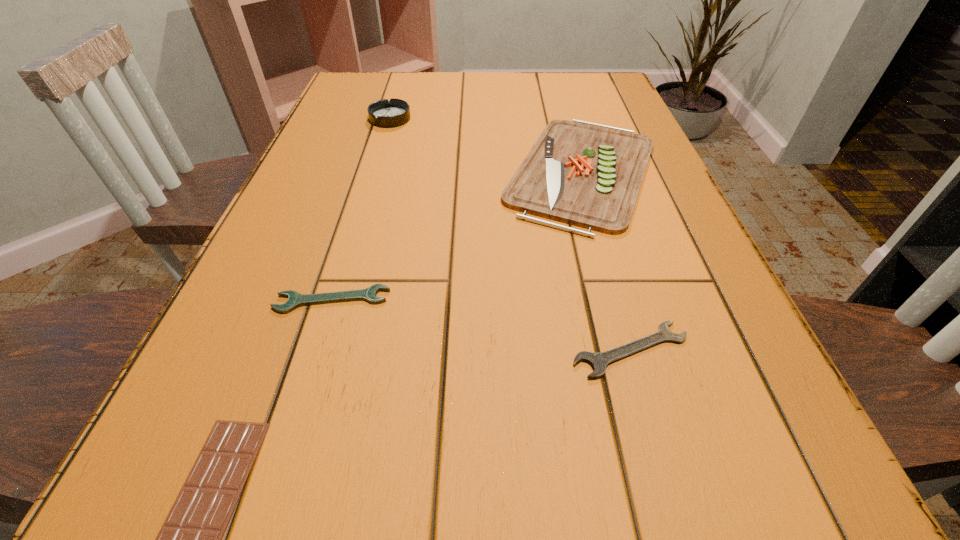
Find the location of a particular element. ashtray that is positioned at the left edge is located at coordinates (382, 113).

Find the location of a particular element. The height and width of the screenshot is (540, 960). wrench at the left edge is located at coordinates (295, 299).

You are a GUI agent. You are given a task and a screenshot of the screen. Output one action in this format:
    pyautogui.click(x=<x>, y=<y>)
    Task: Click on the chopping board located in the right edge section of the desktop
    This screenshot has height=540, width=960.
    Given the screenshot: What is the action you would take?
    pyautogui.click(x=580, y=173)

Where is `wrench present at the right edge`? Image resolution: width=960 pixels, height=540 pixels. wrench present at the right edge is located at coordinates (599, 361).

In the image, there is a desktop. Where is `free space at the far edge`? This screenshot has height=540, width=960. free space at the far edge is located at coordinates (465, 89).

In order to click on free space at the near edge of the desktop in this screenshot , I will do `click(663, 539)`.

This screenshot has width=960, height=540. What are the coordinates of `vacant space at the left edge of the desktop` in the screenshot? It's located at (279, 341).

In the image, there is a desktop. What are the coordinates of `free space at the right edge` in the screenshot? It's located at (708, 286).

This screenshot has height=540, width=960. In order to click on vacant space at the far right corner of the desktop in this screenshot , I will do `click(610, 84)`.

This screenshot has width=960, height=540. In order to click on vacant point located between the fourth farthest object and the third nearest object in this screenshot , I will do `click(482, 325)`.